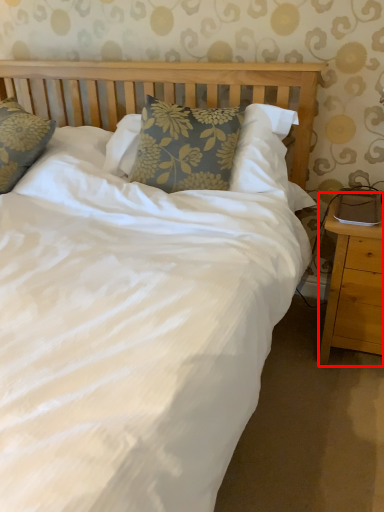
Question: Considering the relative positions of nightstand (annotated by the red box) and pillow in the image provided, where is nightstand (annotated by the red box) located with respect to the staircase?

Choices:
 (A) right
 (B) left

Answer: (A)